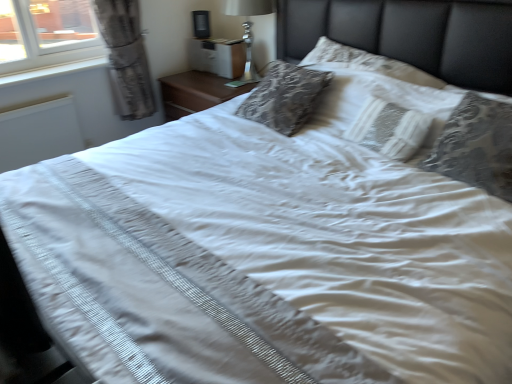
Locate an element on the screen. white plastic window sill at left is located at coordinates (52, 70).

This screenshot has height=384, width=512. Describe the element at coordinates (39, 133) in the screenshot. I see `white matte radiator at left` at that location.

Where is `white plastic window sill at left`? This screenshot has width=512, height=384. white plastic window sill at left is located at coordinates (52, 70).

Is white plastic window sill at left looking in the opposite direction of silver metallic lamp at upper center?

white plastic window sill at left does not have its back to silver metallic lamp at upper center.

Does white plastic window sill at left have a larger size compared to silver metallic lamp at upper center?

No.

What's the angular difference between silver metallic lamp at upper center and white plastic window sill at left's facing directions?

They differ by 90 degrees in their facing directions.

Relative to white plastic window sill at left, is silver metallic lamp at upper center in front or behind?

Visually, silver metallic lamp at upper center is located behind white plastic window sill at left.

Is silver metallic lamp at upper center not close to white plastic window sill at left?

Yes.

In the scene shown: From a real-world perspective, who is located higher, silver metallic lamp at upper center or white plastic window sill at left?

In real-world perspective, silver metallic lamp at upper center is above.

How far apart are white lace pillow at center, the 2th pillow viewed from the right, and white matte radiator at left?

A distance of 1.79 meters exists between white lace pillow at center, the 2th pillow viewed from the right, and white matte radiator at left.

From a real-world perspective, which object stands above the other?

white lace pillow at center, which ranks as the 1th pillow in left-to-right order, is physically above.

The height and width of the screenshot is (384, 512). What are the coordinates of `pillow that is the 1st one above the white matte radiator at left (from a real-world perspective)` in the screenshot? It's located at (380, 97).

Would you say white matte radiator at left is part of white lace pillow at center, which ranks as the 1th pillow in left-to-right order,'s contents?

That's incorrect, white matte radiator at left is not inside white lace pillow at center, which ranks as the 1th pillow in left-to-right order.

From a real-world perspective, between silver metallic lamp at upper center and white lace pillow at center, which ranks as the 1th pillow in left-to-right order, who is vertically higher?

silver metallic lamp at upper center.

Is silver metallic lamp at upper center outside of white lace pillow at center, which ranks as the 1th pillow in left-to-right order?

silver metallic lamp at upper center lies outside white lace pillow at center, which ranks as the 1th pillow in left-to-right order,'s area.

Which of these two, silver metallic lamp at upper center or white lace pillow at center, which ranks as the 1th pillow in left-to-right order, stands shorter?

white lace pillow at center, which ranks as the 1th pillow in left-to-right order, is shorter.

Is point (245, 27) farther from camera compared to point (352, 118)?

That is True.

Considering the sizes of objects white lace pillow at center, the 2th pillow viewed from the right, and patterned fabric pillow at upper right, marked as the 2th pillow in a left-to-right arrangement, in the image provided, who is thinner, white lace pillow at center, the 2th pillow viewed from the right, or patterned fabric pillow at upper right, marked as the 2th pillow in a left-to-right arrangement,?

white lace pillow at center, the 2th pillow viewed from the right, is thinner.

From the image's perspective, is white lace pillow at center, which ranks as the 1th pillow in left-to-right order, over patterned fabric pillow at upper right, which is counted as the first pillow, starting from the right?

Indeed, from the image's perspective, white lace pillow at center, which ranks as the 1th pillow in left-to-right order, is shown above patterned fabric pillow at upper right, which is counted as the first pillow, starting from the right.

Is white lace pillow at center, which ranks as the 1th pillow in left-to-right order, not inside patterned fabric pillow at upper right, marked as the 2th pillow in a left-to-right arrangement?

white lace pillow at center, which ranks as the 1th pillow in left-to-right order, lies outside patterned fabric pillow at upper right, marked as the 2th pillow in a left-to-right arrangement,'s area.

Would you consider white lace pillow at center, which ranks as the 1th pillow in left-to-right order, to be distant from patterned fabric pillow at upper right, marked as the 2th pillow in a left-to-right arrangement?

No, there isn't a large distance between white lace pillow at center, which ranks as the 1th pillow in left-to-right order, and patterned fabric pillow at upper right, marked as the 2th pillow in a left-to-right arrangement.

This screenshot has height=384, width=512. Identify the location of radiator above the patterned fabric pillow at upper right, marked as the 2th pillow in a left-to-right arrangement (from the image's perspective). (39, 133).

Is patterned fabric pillow at upper right, marked as the 2th pillow in a left-to-right arrangement, wider or thinner than white matte radiator at left?

Clearly, patterned fabric pillow at upper right, marked as the 2th pillow in a left-to-right arrangement, has more width compared to white matte radiator at left.

Measure the distance between patterned fabric pillow at upper right, marked as the 2th pillow in a left-to-right arrangement, and white matte radiator at left.

They are 2.29 meters apart.

Between patterned fabric pillow at upper right, which is counted as the first pillow, starting from the right, and white matte radiator at left, which one appears on the left side from the viewer's perspective?

Positioned to the left is white matte radiator at left.

From the picture: Is silver metallic lamp at upper center turned away from white matte radiator at left?

No, white matte radiator at left is not at the back of silver metallic lamp at upper center.

In the scene shown: From the image's perspective, is silver metallic lamp at upper center positioned above or below white matte radiator at left?

From the image's perspective, silver metallic lamp at upper center appears above white matte radiator at left.

From a real-world perspective, which object rests below the other?

In real-world perspective, white matte radiator at left is lower.

The image size is (512, 384). Identify the location of bedside lamp above the white plastic window sill at left (from the image's perspective). (248, 7).

Identify the location of bedside lamp that appears on the right of white plastic window sill at left. The image size is (512, 384). (248, 7).

Looking at the image, which one is located further to white plastic window sill at left, white matte radiator at left or white lace pillow at center, which ranks as the 1th pillow in left-to-right order?

Among the two, white lace pillow at center, which ranks as the 1th pillow in left-to-right order, is located further to white plastic window sill at left.

Considering their positions, is white lace pillow at center, the 2th pillow viewed from the right, positioned further to white plastic window sill at left than patterned fabric pillow at upper right, marked as the 2th pillow in a left-to-right arrangement?

Among the two, patterned fabric pillow at upper right, marked as the 2th pillow in a left-to-right arrangement, is located further to white plastic window sill at left.

From the image, which object appears to be nearer to silver metallic lamp at upper center, white plastic window sill at left or patterned fabric pillow at upper right, which is counted as the first pillow, starting from the right?

white plastic window sill at left is closer to silver metallic lamp at upper center.

From the image, which object appears to be farther from white matte radiator at left, white plastic window sill at left or patterned fabric pillow at upper right, which is counted as the first pillow, starting from the right?

patterned fabric pillow at upper right, which is counted as the first pillow, starting from the right, is positioned further to the anchor white matte radiator at left.

Considering their positions, is white lace pillow at center, the 2th pillow viewed from the right, positioned closer to silver metallic lamp at upper center than patterned fabric pillow at upper right, which is counted as the first pillow, starting from the right?

Answer: white lace pillow at center, the 2th pillow viewed from the right, lies closer to silver metallic lamp at upper center than the other object.

When comparing their distances from white matte radiator at left, does patterned fabric pillow at upper right, marked as the 2th pillow in a left-to-right arrangement, or silver metallic lamp at upper center seem further?

patterned fabric pillow at upper right, marked as the 2th pillow in a left-to-right arrangement.

Looking at the image, which one is located closer to white lace pillow at center, which ranks as the 1th pillow in left-to-right order, white matte radiator at left or patterned fabric pillow at upper right, which is counted as the first pillow, starting from the right?

Among the two, patterned fabric pillow at upper right, which is counted as the first pillow, starting from the right, is located nearer to white lace pillow at center, which ranks as the 1th pillow in left-to-right order.

From the picture: Looking at the image, which one is located further to white matte radiator at left, white plastic window sill at left or silver metallic lamp at upper center?

Based on the image, silver metallic lamp at upper center appears to be further to white matte radiator at left.

What are the coordinates of `bedside lamp between white matte radiator at left and white lace pillow at center, which ranks as the 1th pillow in left-to-right order` in the screenshot? It's located at coord(248,7).

Identify the location of window sill located between white matte radiator at left and silver metallic lamp at upper center in the left-right direction. (52, 70).

The image size is (512, 384). Find the location of `pillow positioned between patterned fabric pillow at upper right, which is counted as the first pillow, starting from the right, and silver metallic lamp at upper center from near to far`. pillow positioned between patterned fabric pillow at upper right, which is counted as the first pillow, starting from the right, and silver metallic lamp at upper center from near to far is located at coordinates (380, 97).

Locate an element on the screen. This screenshot has height=384, width=512. pillow between white matte radiator at left and patterned fabric pillow at upper right, marked as the 2th pillow in a left-to-right arrangement, from left to right is located at coordinates [x=380, y=97].